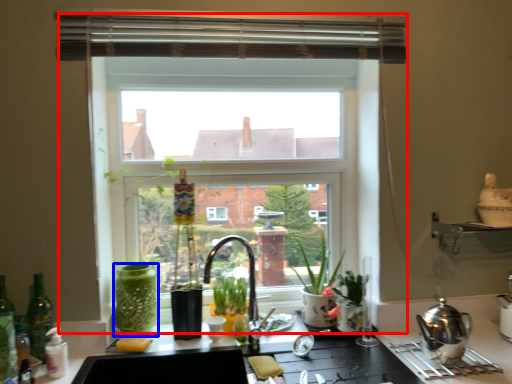
Question: Which object appears closest to the camera in this image, window (highlighted by a red box) or glass vase (highlighted by a blue box)?

Choices:
 (A) window
 (B) glass vase

Answer: (B)